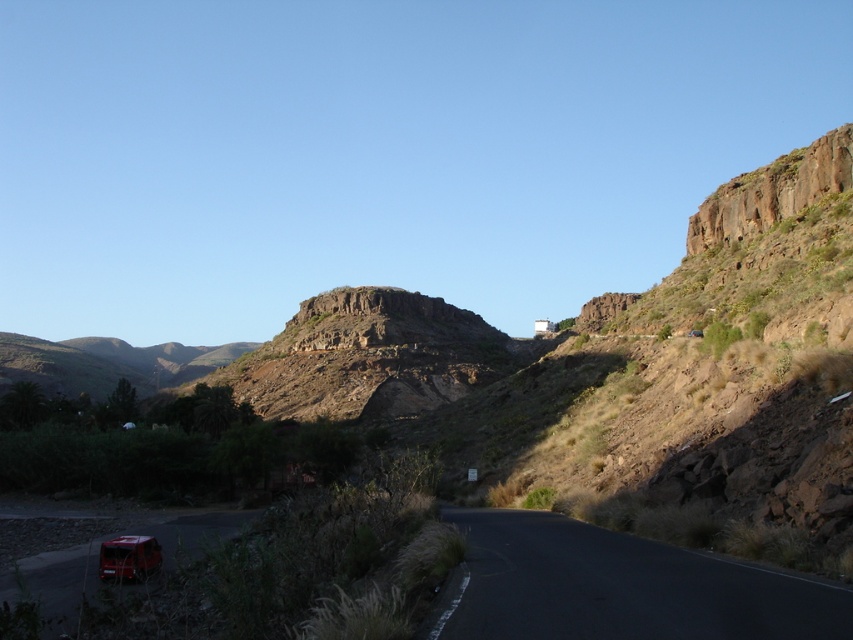
Between black asphalt road at lower right and metallic red car at lower left, which one is positioned higher?

black asphalt road at lower right

Describe the element at coordinates (618, 588) in the screenshot. The height and width of the screenshot is (640, 853). I see `black asphalt road at lower right` at that location.

This screenshot has height=640, width=853. In order to click on black asphalt road at lower right in this screenshot , I will do `click(618, 588)`.